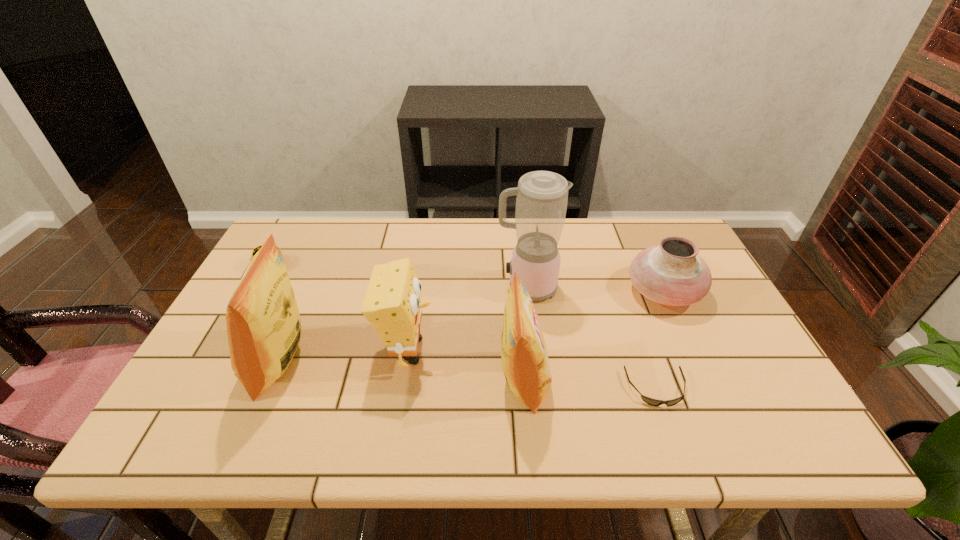
Considering the uniform spacing of crisp (potato chip)s, where should an additional crisp (potato chip) be positioned on the right? Please locate a free spot. Please provide its 2D coordinates. Your answer should be formatted as a tuple, i.e. [(x, y)], where the tuple contains the x and y coordinates of a point satisfying the conditions above.

[(785, 398)]